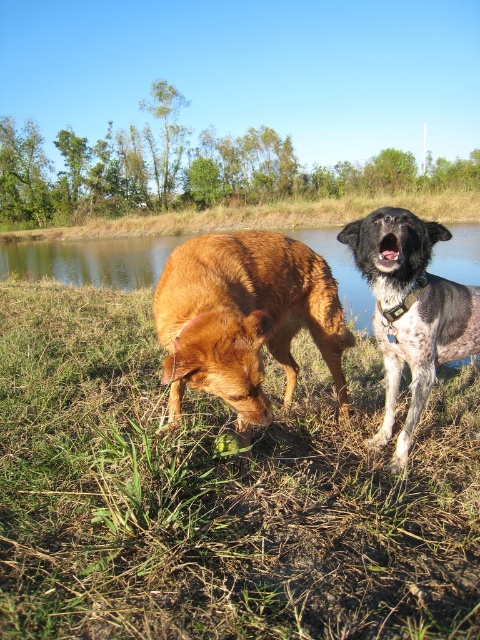
You are standing in the field and see two points marked in the image. Which point is nearer to you, point (358,621) or point (284,356)?

Point (358,621) is closer to the viewer than point (284,356).

You are standing at the center of the image and want to locate the golden brown fur at lower left. In which direction should you look relative to your current position?

The golden brown fur at lower left is located at coordinates 0.498 on the x and y axes, so you should look to the lower left direction from your current position at the center of the image.